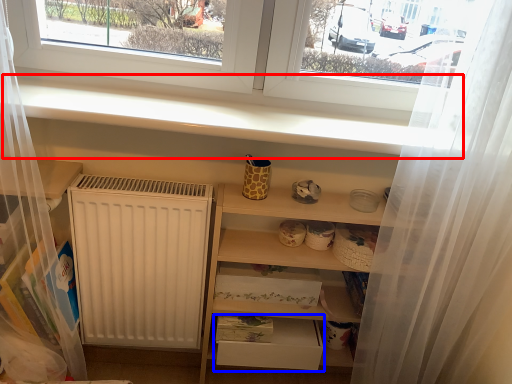
Question: Among these objects, which one is nearest to the camera, window sill (highlighted by a red box) or drawer (highlighted by a blue box)?

Choices:
 (A) window sill
 (B) drawer

Answer: (A)